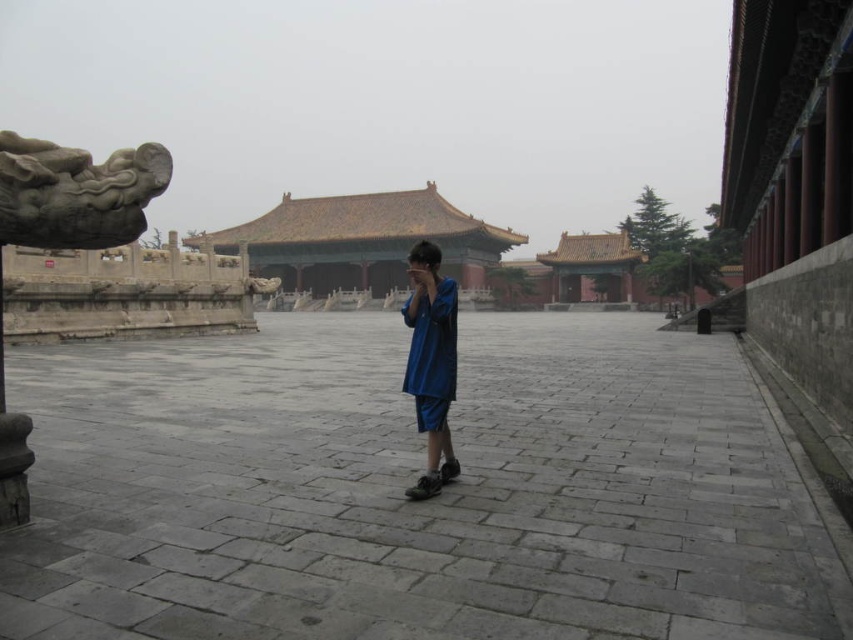
Which is below, yellow/golden tile roof at center or blue cotton robe at center?

Positioned lower is blue cotton robe at center.

Is yellow/golden tile roof at center closer to the viewer compared to blue cotton robe at center?

No, it is behind blue cotton robe at center.

Does point (334, 230) lie in front of point (445, 346)?

No, it is behind (445, 346).

I want to click on yellow/golden tile roof at center, so click(x=363, y=241).